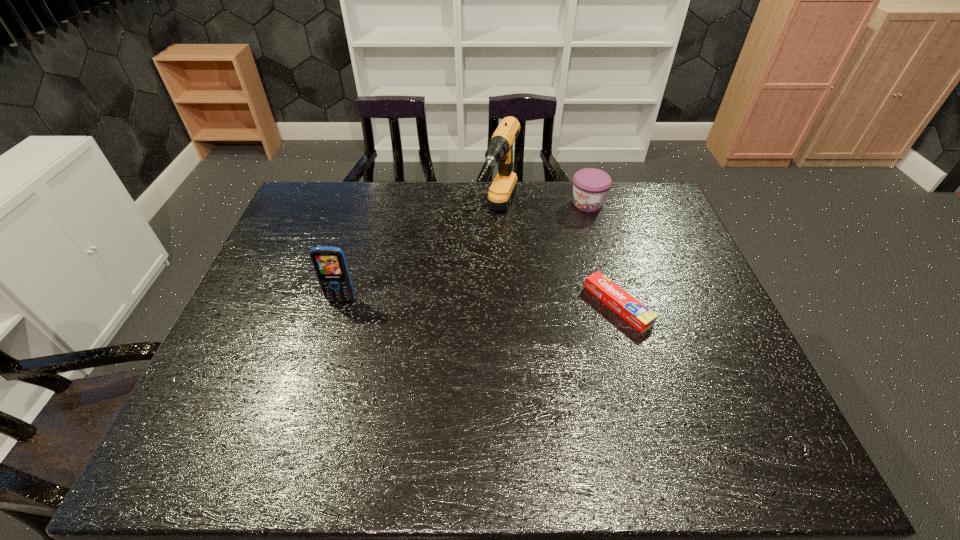
Locate an element on the screen. This screenshot has height=540, width=960. the leftmost object is located at coordinates (330, 265).

Where is `cellular telephone`? The width and height of the screenshot is (960, 540). cellular telephone is located at coordinates (330, 265).

The width and height of the screenshot is (960, 540). I want to click on the shortest object, so click(x=635, y=313).

Identify the location of drill. (500, 149).

I want to click on the second object from left to right, so click(500, 149).

Identify the location of jam. (590, 186).

This screenshot has height=540, width=960. Find the location of `free location located on the screen of the second tallest object`. free location located on the screen of the second tallest object is located at coordinates (327, 346).

The height and width of the screenshot is (540, 960). Find the location of `free spot located 0.090m on the back of the shortest object`. free spot located 0.090m on the back of the shortest object is located at coordinates (604, 259).

I want to click on vacant space situated 0.120m at the tip of the tallest object, so click(482, 271).

What are the coordinates of `free space located 0.220m at the tip of the tallest object` in the screenshot? It's located at (471, 294).